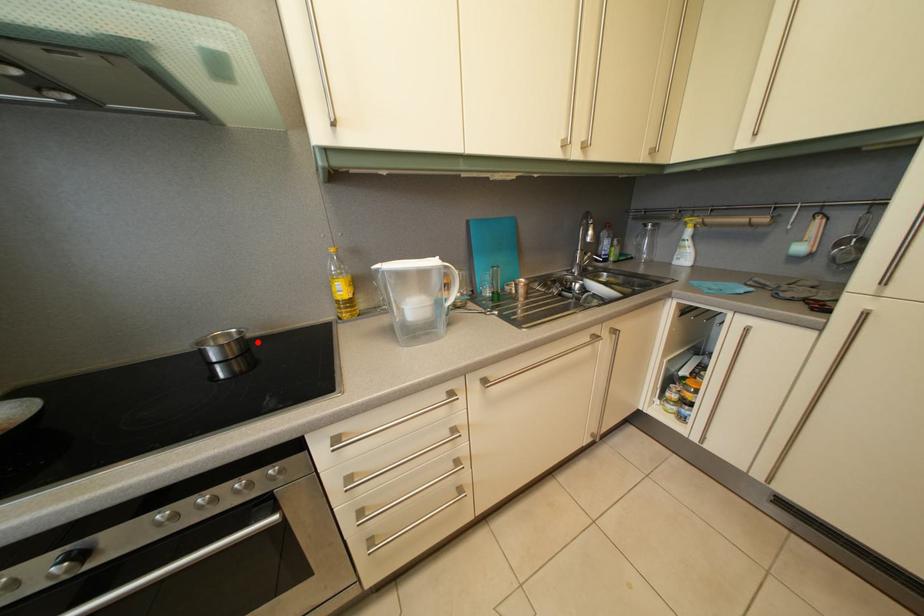
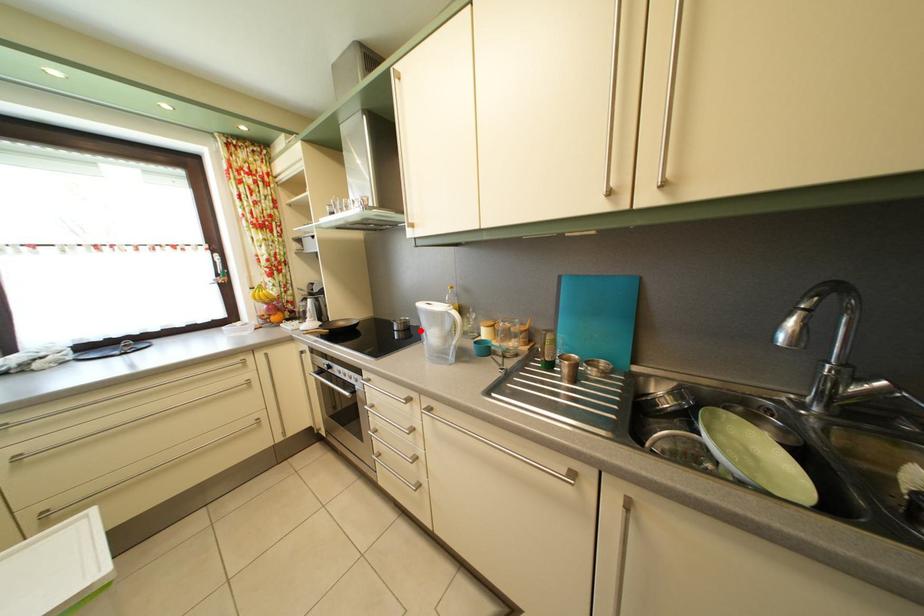
I am providing you with two images of the same scene from different viewpoints. A red point is marked on the first image and another point is marked on the second image. Do the highlighted points in image1 and image2 indicate the same real-world spot?

Yes